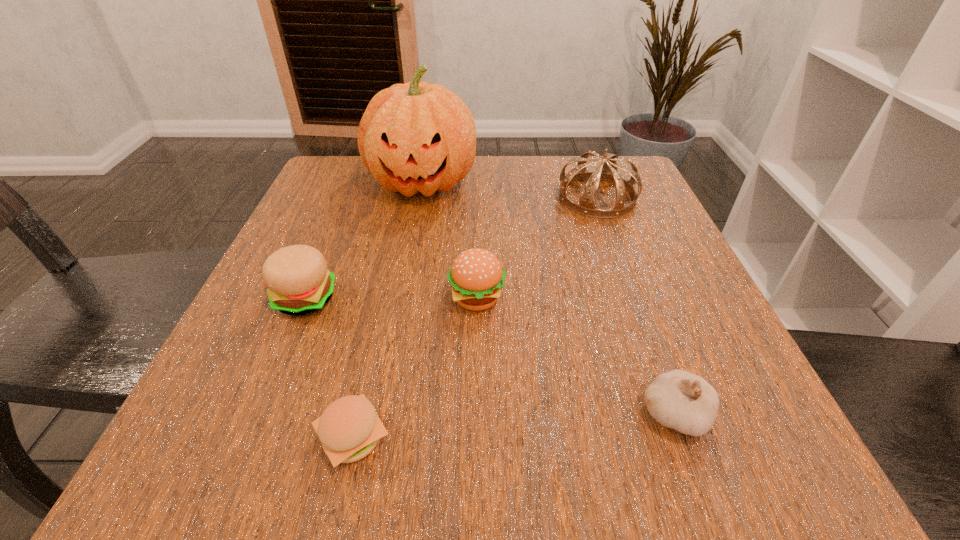
At what (x,y) coordinates should I click in order to perform the action: click on pumpkin. Please return your answer as a coordinate pair (x, y). This screenshot has height=540, width=960. Looking at the image, I should click on (415, 137).

Identify the location of tiara. (607, 171).

The image size is (960, 540). What are the coordinates of `the leftmost hamburger` in the screenshot? It's located at (298, 282).

Locate an element on the screen. This screenshot has height=540, width=960. the rightmost hamburger is located at coordinates (476, 276).

The width and height of the screenshot is (960, 540). Find the location of `garlic`. garlic is located at coordinates (677, 399).

The height and width of the screenshot is (540, 960). Find the location of `the second hamburger from right to left`. the second hamburger from right to left is located at coordinates 349,429.

At what (x,y) coordinates should I click in order to perform the action: click on the shortest hamburger. Please return your answer as a coordinate pair (x, y). This screenshot has height=540, width=960. Looking at the image, I should click on (349, 429).

This screenshot has height=540, width=960. Identify the location of blank area located on the carved face of the tallest object. (415, 227).

Image resolution: width=960 pixels, height=540 pixels. What are the coordinates of `vacant space located 0.320m on the left of the tiara` in the screenshot? It's located at (413, 198).

You are a GUI agent. You are given a task and a screenshot of the screen. Output one action in this format:
    pyautogui.click(x=<x>, y=<y>)
    Task: Click on the vacant region located 0.300m on the right of the leftmost hamburger
    
    Given the screenshot: What is the action you would take?
    pyautogui.click(x=516, y=299)